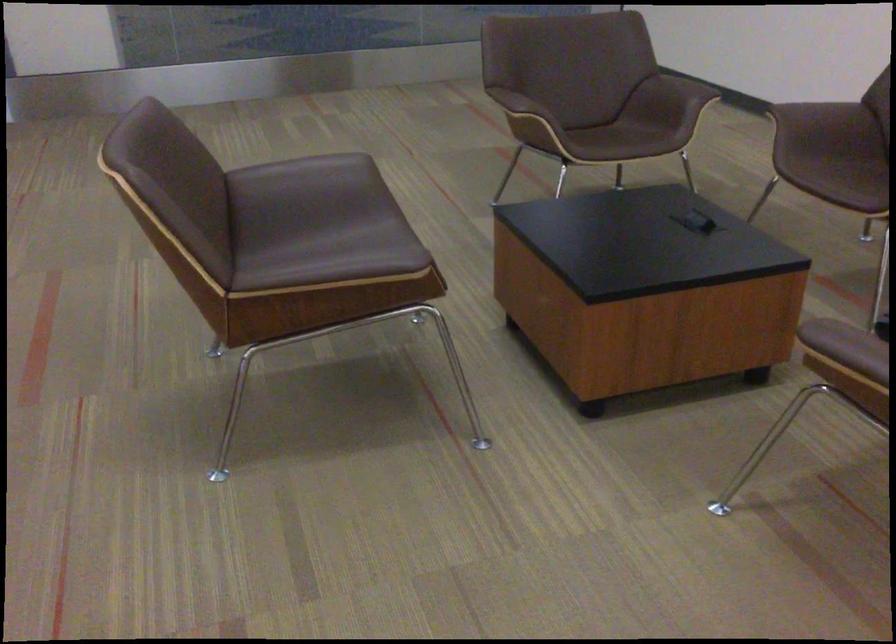
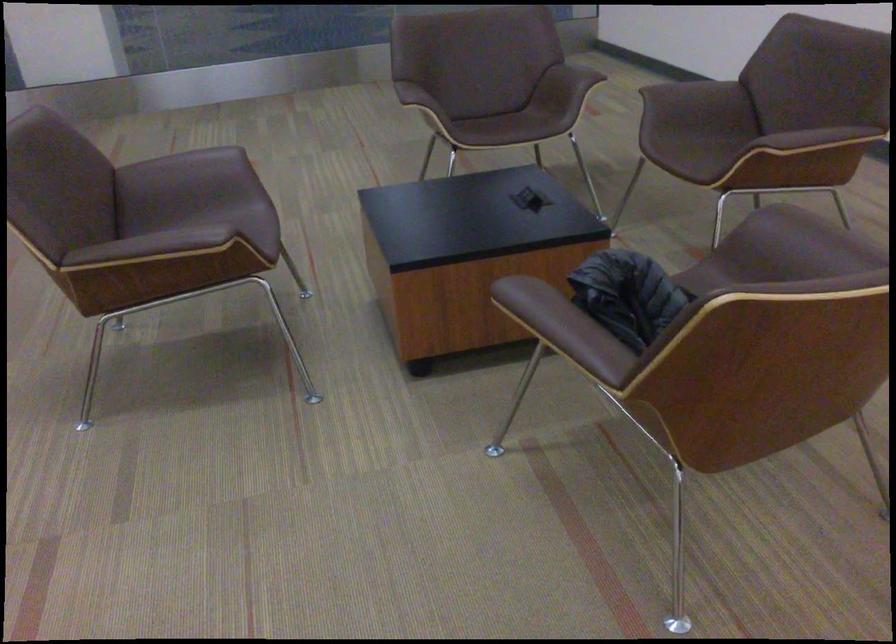
Locate, in the second image, the point that corresponds to point (359, 261) in the first image.

(174, 242)